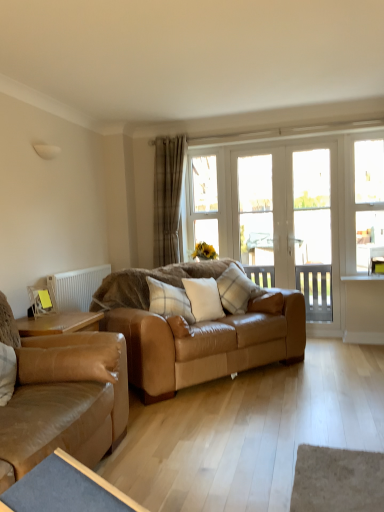
Question: In terms of height, does clear glass window at center, which is the third window from right to left, look taller or shorter compared to beige plaid curtain at center?

Choices:
 (A) short
 (B) tall

Answer: (A)

Question: Would you say clear glass window at center, which ranks as the first window in left-to-right order, is inside or outside beige plaid curtain at center?

Choices:
 (A) inside
 (B) outside

Answer: (B)

Question: Estimate the real-world distances between objects in this image. Which object is closer to the white plastic radiator at left?

Choices:
 (A) clear glass window at center, which ranks as the first window in left-to-right order
 (B) white plaid pillow at center, the third pillow viewed from the right
 (C) blue fabric table at lower left
 (D) beige plaid curtain at center
 (E) clear glass window at right, arranged as the first window when viewed from the right

Answer: (B)

Question: Which object is the farthest from the white glass screen door at center, which ranks as the 1th screen door in left-to-right order?

Choices:
 (A) plaid fabric pillow at center, positioned as the 1th pillow in right-to-left order
 (B) clear glass door at center, the second window viewed from the right
 (C) leather couch at center, which is the first studio couch in back-to-front order
 (D) clear glass window at right, arranged as the first window when viewed from the right
 (E) clear glass window at center, which ranks as the first window in left-to-right order

Answer: (C)